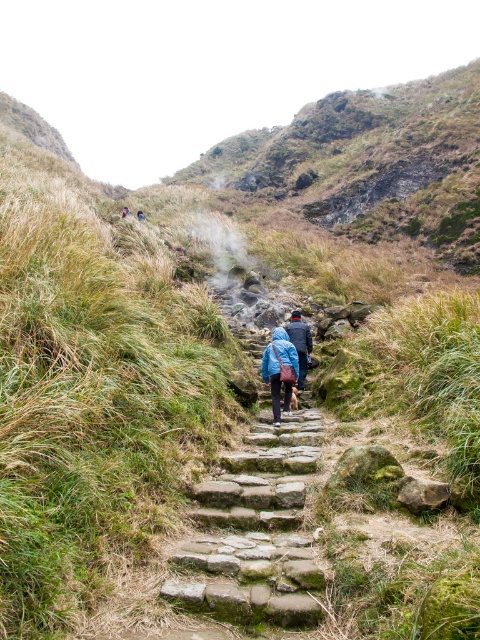
Question: Can you confirm if blue fabric bag at center is bigger than blue fabric jacket at center?

Choices:
 (A) yes
 (B) no

Answer: (B)

Question: Which of the following is the farthest from the observer?

Choices:
 (A) (305, 344)
 (B) (282, 326)

Answer: (A)

Question: Which object is the farthest from the blue fabric bag at center?

Choices:
 (A) blue fabric jacket at center
 (B) green mossy stone stairs at center

Answer: (B)

Question: Is green mossy stone stairs at center wider than blue fabric jacket at center?

Choices:
 (A) no
 (B) yes

Answer: (B)

Question: Considering the real-world distances, which object is closest to the green mossy stone stairs at center?

Choices:
 (A) blue fabric jacket at center
 (B) blue fabric bag at center

Answer: (B)

Question: Is green mossy stone stairs at center thinner than blue fabric bag at center?

Choices:
 (A) no
 (B) yes

Answer: (A)